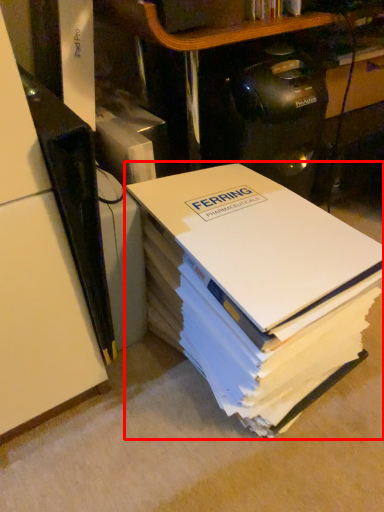
Question: Considering the relative positions of book (annotated by the red box) and shelf in the image provided, where is book (annotated by the red box) located with respect to the staircase?

Choices:
 (A) left
 (B) right

Answer: (B)